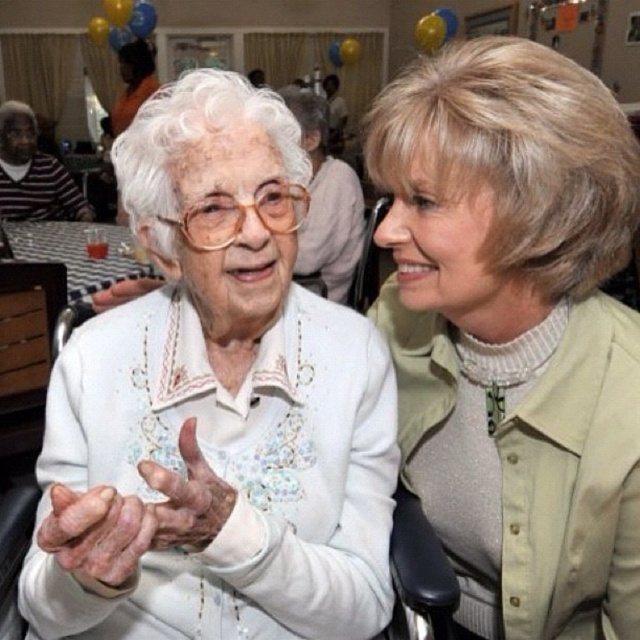
You are a photographer at the event and want to capture a closeup of the light beige sweater at center without the dry skin hand at center covering it. Is the hand currently blocking the sweater?

The light beige sweater at center is positioned over dry skin hand at center, so the hand is underneath the sweater and not blocking it. Therefore, the hand is not currently covering the sweater, so the photographer can capture the closeup without the hand obstructing the sweater.

You are a tailor who needs to determine if the dry skin hand at center can comfortably fit into the sleeve of the light beige sweater at center. Based on the image, can the hand fit into the sleeve?

The light beige sweater at center has a larger width than the dry skin hand at center, so the hand should comfortably fit into the sleeve.

You are a photographer at the event and want to capture a closeup of both the dry skin hand at center and the white matte hand at center in the same frame. Given their sizes, which hand will appear larger in the photo?

The dry skin hand at center will appear larger in the photo because it is much taller than the white matte hand at center according to the description.